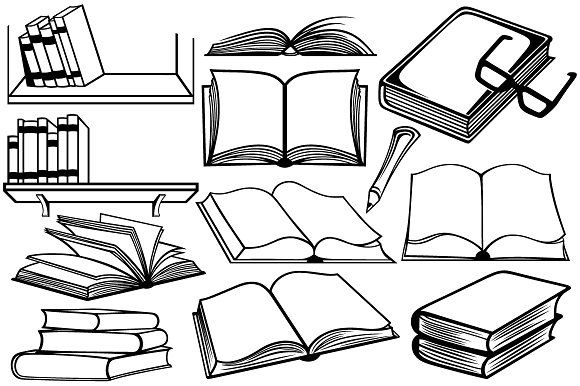
The image size is (580, 386). I want to click on stacked books, so click(95, 372), click(110, 343), click(110, 321), click(432, 349), click(438, 331).